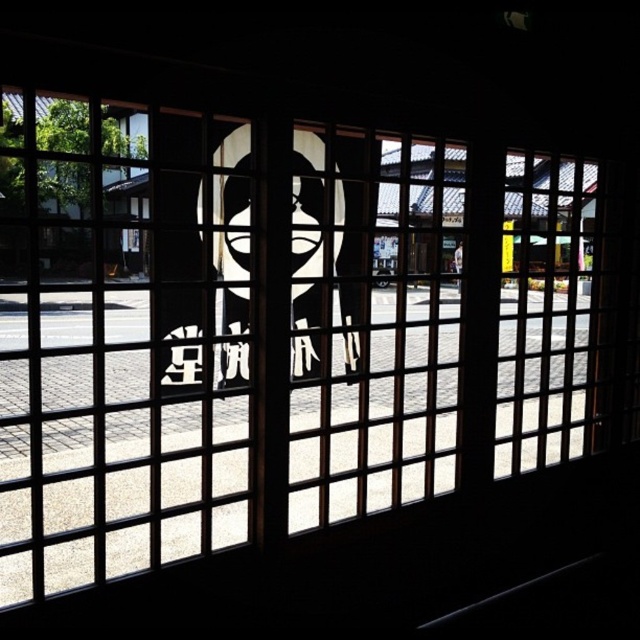
Is translucent wood door at center behind wooden lattice door at right?

No, it is in front of wooden lattice door at right.

Between translucent wood door at center and wooden lattice door at right, which one is positioned higher?

wooden lattice door at right is higher up.

Describe the element at coordinates (378, 358) in the screenshot. The width and height of the screenshot is (640, 640). I see `translucent wood door at center` at that location.

You are a GUI agent. You are given a task and a screenshot of the screen. Output one action in this format:
    pyautogui.click(x=<x>, y=<y>)
    Task: Click on the translucent wood door at center
    
    Given the screenshot: What is the action you would take?
    pyautogui.click(x=378, y=358)

Consider the image. Who is taller, transparent glass door at center or translucent wood door at center?

transparent glass door at center

Does transparent glass door at center come behind translucent wood door at center?

No, transparent glass door at center is closer to the viewer.

Is point (58, 522) positioned behind point (387, 214)?

No, (58, 522) is closer to viewer.

Image resolution: width=640 pixels, height=640 pixels. What are the coordinates of `transparent glass door at center` in the screenshot? It's located at (109, 356).

Can you confirm if transparent glass door at center is taller than wooden lattice door at right?

Indeed, transparent glass door at center has a greater height compared to wooden lattice door at right.

Find the location of `transparent glass door at center`. transparent glass door at center is located at coordinates (109, 356).